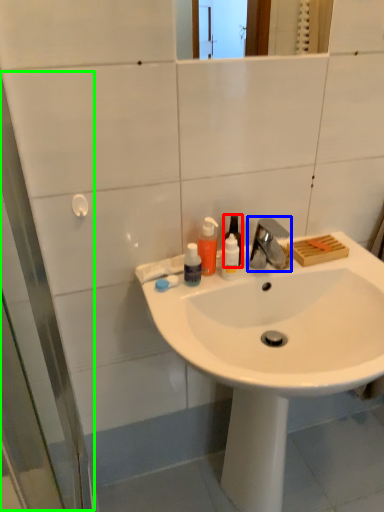
Question: Which object is the closest to the bottle (highlighted by a red box)? Choose among these: tap (highlighted by a blue box) or screen door (highlighted by a green box).

Choices:
 (A) tap
 (B) screen door

Answer: (A)